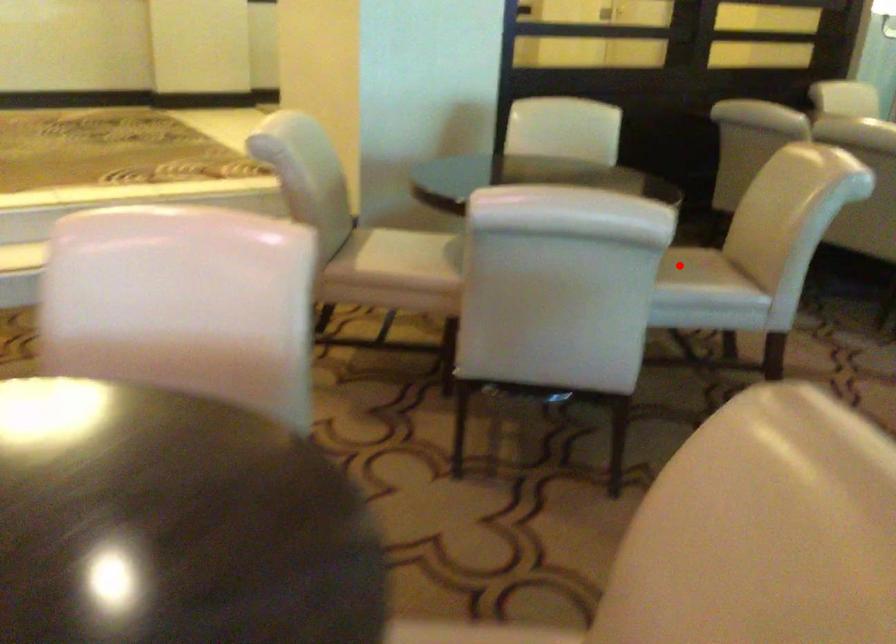
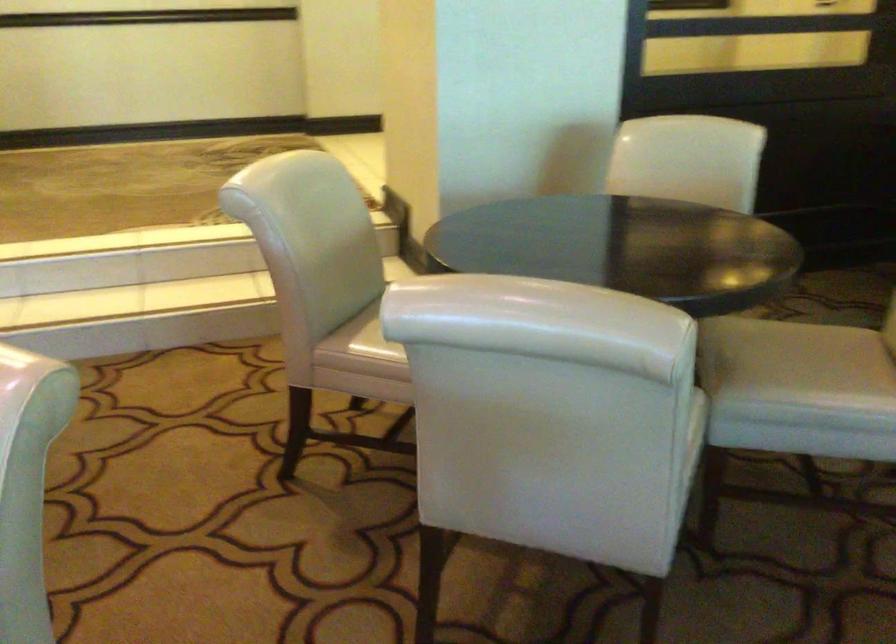
Question: I am providing you with two images of the same scene from different viewpoints. Given a red point in image1, look at the same physical point in image2. Is it:

Choices:
 (A) Closer to the viewpoint
 (B) Farther from the viewpoint

Answer: (A)